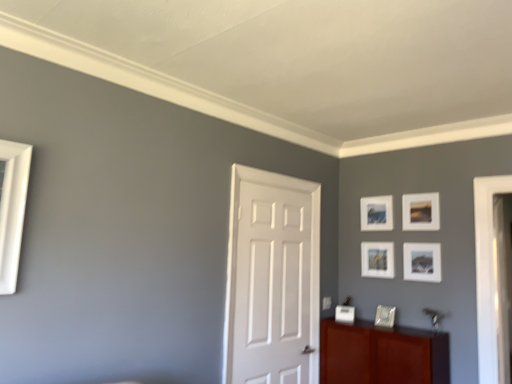
How much space does white matte picture frame at upper right, which appears as the fourth picture frame when ordered from the bottom, occupy horizontally?

The width of white matte picture frame at upper right, which appears as the fourth picture frame when ordered from the bottom, is 1.68 inches.

You are a GUI agent. You are given a task and a screenshot of the screen. Output one action in this format:
    pyautogui.click(x=<x>, y=<y>)
    Task: Click on the matte white picture frame at upper right, which appears as the third picture frame when ordered from the bottom
    
    Given the screenshot: What is the action you would take?
    pyautogui.click(x=422, y=262)

Where is `matte white picture frame at lower center, the first picture frame ordered from the bottom`? Image resolution: width=512 pixels, height=384 pixels. matte white picture frame at lower center, the first picture frame ordered from the bottom is located at coordinates (385, 316).

Image resolution: width=512 pixels, height=384 pixels. What do you see at coordinates (385, 316) in the screenshot?
I see `matte white picture frame at lower center, the first picture frame ordered from the bottom` at bounding box center [385, 316].

Find the location of `matte white picture frame at center, which is counted as the fourth picture frame, starting from the top`. matte white picture frame at center, which is counted as the fourth picture frame, starting from the top is located at coordinates (377, 259).

What is the approximate width of white matte door at center?

It is 1.11 inches.

I want to click on white matte picture frame at upper right, positioned as the second picture frame in top-to-bottom order, so click(376, 213).

Consider the image. From a real-world perspective, is matte white picture frame at center, which ranks as the 2th picture frame in bottom-to-top order, on top of matte white picture frame at lower center, the first picture frame ordered from the bottom?

Yes, from a real-world perspective, matte white picture frame at center, which ranks as the 2th picture frame in bottom-to-top order, is on top of matte white picture frame at lower center, the first picture frame ordered from the bottom.

Is matte white picture frame at center, which is counted as the fourth picture frame, starting from the top, inside or outside of matte white picture frame at lower center, the first picture frame ordered from the bottom?

matte white picture frame at center, which is counted as the fourth picture frame, starting from the top, is located beyond the bounds of matte white picture frame at lower center, the first picture frame ordered from the bottom.

Is the surface of matte white picture frame at center, which is counted as the fourth picture frame, starting from the top, in direct contact with matte white picture frame at lower center, the first picture frame ordered from the bottom?

No, matte white picture frame at center, which is counted as the fourth picture frame, starting from the top, is not making contact with matte white picture frame at lower center, the first picture frame ordered from the bottom.

From the image's perspective, does matte white picture frame at center, which ranks as the 2th picture frame in bottom-to-top order, appear higher than matte white picture frame at lower center, the first picture frame ordered from the bottom?

Yes, from the image's perspective, matte white picture frame at center, which ranks as the 2th picture frame in bottom-to-top order, is on top of matte white picture frame at lower center, the first picture frame ordered from the bottom.

Is matte white picture frame at upper right, positioned as the first picture frame in top-to-bottom order, not near white matte door at center?

Yes.

From a real-world perspective, relative to white matte door at center, is matte white picture frame at upper right, positioned as the first picture frame in top-to-bottom order, vertically above or below?

From a real-world perspective, matte white picture frame at upper right, positioned as the first picture frame in top-to-bottom order, is physically above white matte door at center.

Relative to white matte door at center, is matte white picture frame at upper right, placed as the fifth picture frame when sorted from bottom to top, in front or behind?

Clearly, matte white picture frame at upper right, placed as the fifth picture frame when sorted from bottom to top, is behind white matte door at center.

Is point (302, 263) closer or farther from the camera than point (346, 355)?

Clearly, point (302, 263) is more distant from the camera than point (346, 355).

From the image's perspective, who appears lower, white matte door at center or mahogany wood cabinet at lower right?

mahogany wood cabinet at lower right, from the image's perspective.

Can you confirm if white matte door at center is positioned to the right of mahogany wood cabinet at lower right?

No.

Are matte white picture frame at upper right, placed as the fifth picture frame when sorted from bottom to top, and white matte picture frame at upper right, which appears as the fourth picture frame when ordered from the bottom, beside each other?

There is a gap between matte white picture frame at upper right, placed as the fifth picture frame when sorted from bottom to top, and white matte picture frame at upper right, which appears as the fourth picture frame when ordered from the bottom.

Relative to white matte picture frame at upper right, which appears as the fourth picture frame when ordered from the bottom, is matte white picture frame at upper right, placed as the fifth picture frame when sorted from bottom to top, in front or behind?

matte white picture frame at upper right, placed as the fifth picture frame when sorted from bottom to top, is in front of white matte picture frame at upper right, which appears as the fourth picture frame when ordered from the bottom.

Visually, is matte white picture frame at upper right, placed as the fifth picture frame when sorted from bottom to top, positioned to the left or to the right of white matte picture frame at upper right, which appears as the fourth picture frame when ordered from the bottom?

From the image, it's evident that matte white picture frame at upper right, placed as the fifth picture frame when sorted from bottom to top, is to the right of white matte picture frame at upper right, which appears as the fourth picture frame when ordered from the bottom.

Which of these two, matte white picture frame at upper right, placed as the fifth picture frame when sorted from bottom to top, or white matte picture frame at upper right, positioned as the second picture frame in top-to-bottom order, is smaller?

matte white picture frame at upper right, placed as the fifth picture frame when sorted from bottom to top.

Is matte white picture frame at center, which is counted as the fourth picture frame, starting from the top, a part of matte white picture frame at upper right, positioned as the first picture frame in top-to-bottom order?

No, matte white picture frame at center, which is counted as the fourth picture frame, starting from the top, is not inside matte white picture frame at upper right, positioned as the first picture frame in top-to-bottom order.

Considering the positions of objects matte white picture frame at upper right, placed as the fifth picture frame when sorted from bottom to top, and matte white picture frame at center, which is counted as the fourth picture frame, starting from the top, in the image provided, who is more to the left, matte white picture frame at upper right, placed as the fifth picture frame when sorted from bottom to top, or matte white picture frame at center, which is counted as the fourth picture frame, starting from the top,?

matte white picture frame at center, which is counted as the fourth picture frame, starting from the top.

Does point (424, 212) come closer to viewer compared to point (384, 268)?

Yes, point (424, 212) is closer to viewer.

From a real-world perspective, is matte white picture frame at upper right, placed as the fifth picture frame when sorted from bottom to top, positioned over matte white picture frame at center, which is counted as the fourth picture frame, starting from the top, based on gravity?

Indeed, from a real-world perspective, matte white picture frame at upper right, placed as the fifth picture frame when sorted from bottom to top, stands above matte white picture frame at center, which is counted as the fourth picture frame, starting from the top.

Which object is wider, white matte door at center or matte white picture frame at upper right, placed as the fifth picture frame when sorted from bottom to top?

Wider between the two is matte white picture frame at upper right, placed as the fifth picture frame when sorted from bottom to top.

From the image's perspective, which one is positioned lower, white matte door at center or matte white picture frame at upper right, positioned as the first picture frame in top-to-bottom order?

white matte door at center, from the image's perspective.

Considering the sizes of white matte door at center and matte white picture frame at upper right, positioned as the first picture frame in top-to-bottom order, in the image, is white matte door at center bigger or smaller than matte white picture frame at upper right, positioned as the first picture frame in top-to-bottom order,?

Clearly, white matte door at center is larger in size than matte white picture frame at upper right, positioned as the first picture frame in top-to-bottom order.

Is white matte door at center facing towards matte white picture frame at upper right, placed as the fifth picture frame when sorted from bottom to top?

No, white matte door at center is not oriented towards matte white picture frame at upper right, placed as the fifth picture frame when sorted from bottom to top.

Does mahogany wood cabinet at lower right have a lesser width compared to matte white picture frame at upper right, positioned as the first picture frame in top-to-bottom order?

No, mahogany wood cabinet at lower right is not thinner than matte white picture frame at upper right, positioned as the first picture frame in top-to-bottom order.

Considering the sizes of mahogany wood cabinet at lower right and matte white picture frame at upper right, positioned as the first picture frame in top-to-bottom order, in the image, is mahogany wood cabinet at lower right bigger or smaller than matte white picture frame at upper right, positioned as the first picture frame in top-to-bottom order,?

Considering their sizes, mahogany wood cabinet at lower right takes up more space than matte white picture frame at upper right, positioned as the first picture frame in top-to-bottom order.

From the image's perspective, between mahogany wood cabinet at lower right and matte white picture frame at upper right, placed as the fifth picture frame when sorted from bottom to top, which one is located above?

From the image's view, matte white picture frame at upper right, placed as the fifth picture frame when sorted from bottom to top, is above.

From a real-world perspective, is mahogany wood cabinet at lower right above or below matte white picture frame at upper right, positioned as the first picture frame in top-to-bottom order?

mahogany wood cabinet at lower right is situated lower than matte white picture frame at upper right, positioned as the first picture frame in top-to-bottom order, in the real world.

Identify the location of the 1st picture frame to the right when counting from the matte white picture frame at center, which is counted as the fourth picture frame, starting from the top. (385, 316).

Locate an element on the screen. The width and height of the screenshot is (512, 384). door on the left of matte white picture frame at upper right, positioned as the first picture frame in top-to-bottom order is located at coordinates (272, 279).

Estimate the real-world distances between objects in this image. Which object is closer to white matte door at center, matte white picture frame at upper right, placed as the fifth picture frame when sorted from bottom to top, or mahogany wood cabinet at lower right?

Among the two, mahogany wood cabinet at lower right is located nearer to white matte door at center.

Which object lies nearer to the anchor point matte white picture frame at center, which ranks as the 2th picture frame in bottom-to-top order, white matte door at center or mahogany wood cabinet at lower right?

The object closer to matte white picture frame at center, which ranks as the 2th picture frame in bottom-to-top order, is mahogany wood cabinet at lower right.

From the image, which object appears to be nearer to matte white picture frame at center, which is counted as the fourth picture frame, starting from the top, white matte door at center or white matte picture frame at upper right, positioned as the second picture frame in top-to-bottom order?

white matte picture frame at upper right, positioned as the second picture frame in top-to-bottom order, lies closer to matte white picture frame at center, which is counted as the fourth picture frame, starting from the top, than the other object.

Estimate the real-world distances between objects in this image. Which object is further from matte white picture frame at upper right, positioned as the first picture frame in top-to-bottom order, matte white picture frame at upper right, which appears as the third picture frame when ordered from the bottom, or mahogany wood cabinet at lower right?

mahogany wood cabinet at lower right is positioned further to the anchor matte white picture frame at upper right, positioned as the first picture frame in top-to-bottom order.

Considering their positions, is matte white picture frame at center, which is counted as the fourth picture frame, starting from the top, positioned closer to white matte door at center than white matte picture frame at upper right, which appears as the fourth picture frame when ordered from the bottom?

matte white picture frame at center, which is counted as the fourth picture frame, starting from the top, is closer to white matte door at center.

Which object lies further to the anchor point matte white picture frame at center, which ranks as the 2th picture frame in bottom-to-top order, matte white picture frame at lower center, which is counted as the 5th picture frame, starting from the top, or white matte door at center?

Based on the image, white matte door at center appears to be further to matte white picture frame at center, which ranks as the 2th picture frame in bottom-to-top order.

Based on their spatial positions, is matte white picture frame at upper right, the third picture frame when ordered from top to bottom, or mahogany wood cabinet at lower right further from white matte door at center?

matte white picture frame at upper right, the third picture frame when ordered from top to bottom, lies further to white matte door at center than the other object.

When comparing their distances from matte white picture frame at upper right, positioned as the first picture frame in top-to-bottom order, does matte white picture frame at upper right, the third picture frame when ordered from top to bottom, or white matte picture frame at upper right, positioned as the second picture frame in top-to-bottom order, seem closer?

The object closer to matte white picture frame at upper right, positioned as the first picture frame in top-to-bottom order, is white matte picture frame at upper right, positioned as the second picture frame in top-to-bottom order.

Find the location of a particular element. door between matte white picture frame at upper right, placed as the fifth picture frame when sorted from bottom to top, and mahogany wood cabinet at lower right in the up-down direction is located at coordinates (272, 279).

The height and width of the screenshot is (384, 512). I want to click on cabinetry situated between white matte door at center and matte white picture frame at upper right, which appears as the third picture frame when ordered from the bottom, from left to right, so click(382, 354).

Locate an element on the screen. This screenshot has width=512, height=384. picture frame between matte white picture frame at upper right, which appears as the third picture frame when ordered from the bottom, and matte white picture frame at lower center, the first picture frame ordered from the bottom, in the up-down direction is located at coordinates (377, 259).

I want to click on door between white matte picture frame at upper right, positioned as the second picture frame in top-to-bottom order, and mahogany wood cabinet at lower right from top to bottom, so click(272, 279).